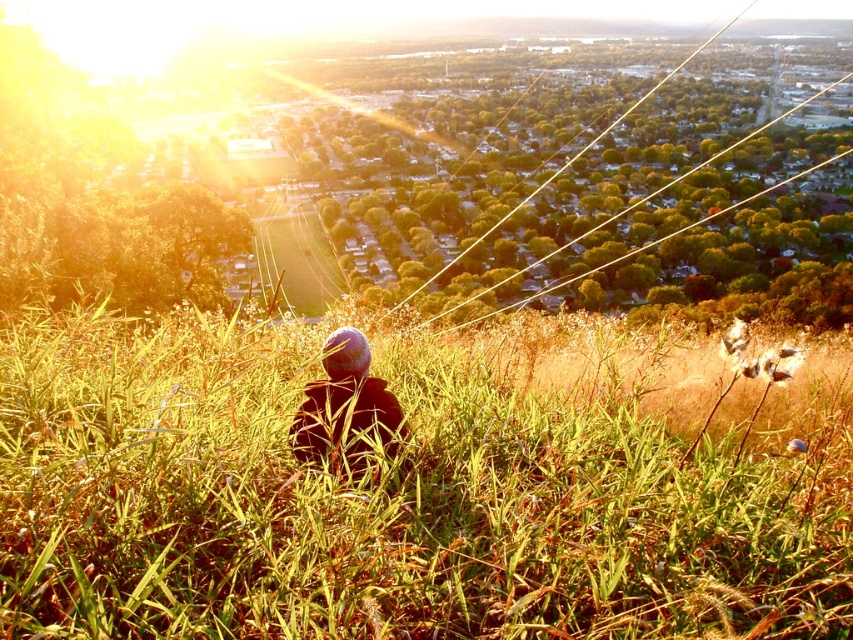
Question: Is green grassy at center further to camera compared to dark fabric hat at center?

Choices:
 (A) yes
 (B) no

Answer: (B)

Question: Does green grassy at center appear on the left side of dark fabric hat at center?

Choices:
 (A) yes
 (B) no

Answer: (B)

Question: Where is green grassy at center located in relation to dark fabric hat at center in the image?

Choices:
 (A) below
 (B) above

Answer: (A)

Question: Which point is farther from the camera taking this photo?

Choices:
 (A) (392, 451)
 (B) (279, 620)

Answer: (A)

Question: Which point is farther from the camera taking this photo?

Choices:
 (A) (341, 328)
 (B) (91, 577)

Answer: (A)